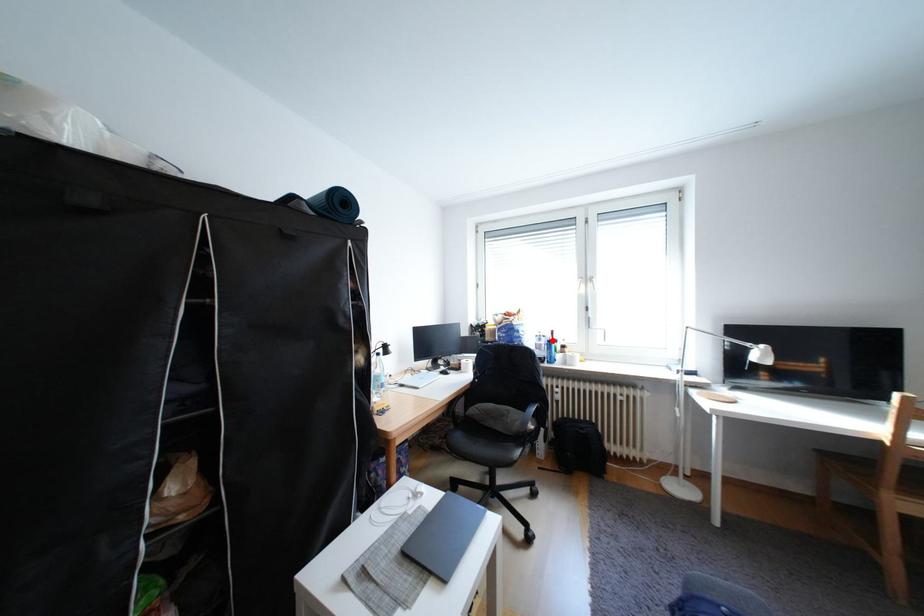
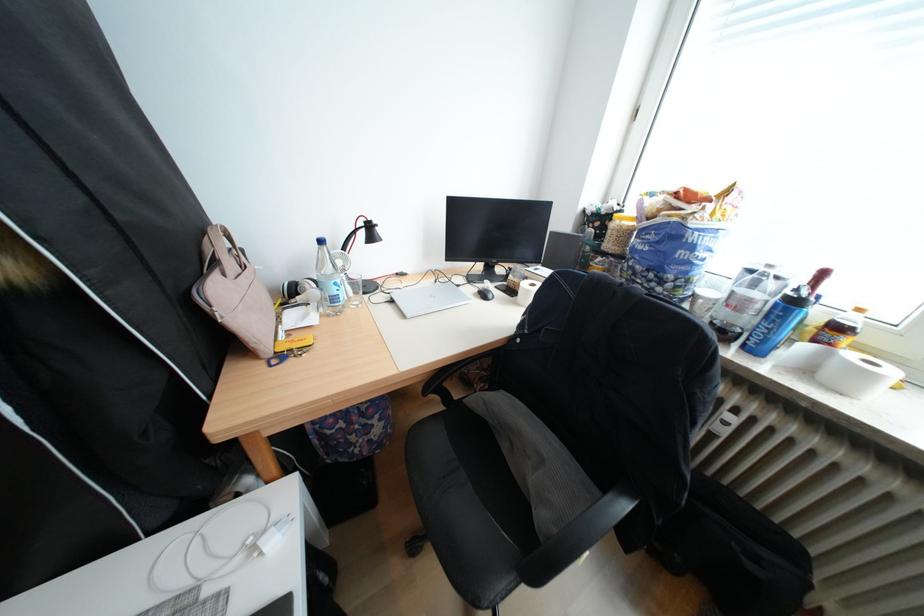
Locate, in the second image, the point that corresponds to the highlighted location in the first image.

(767, 285)